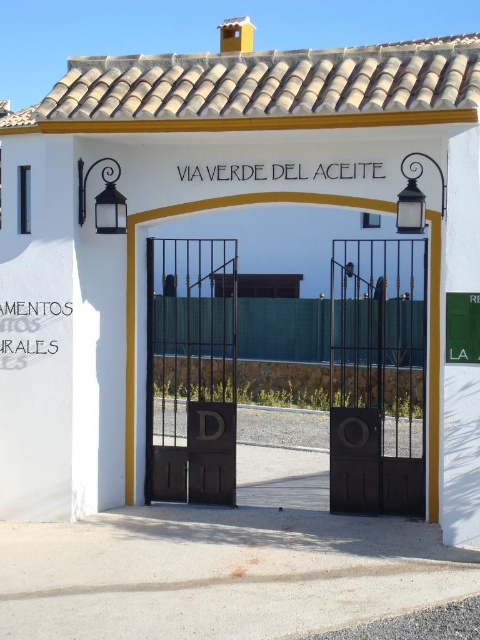
Question: Does black metal gate at center appear on the left side of dark brown wrought iron gate at center?

Choices:
 (A) yes
 (B) no

Answer: (A)

Question: Which object is closer to the camera taking this photo?

Choices:
 (A) brown matte door at center
 (B) black metal gate at center

Answer: (A)

Question: In this image, where is brown matte door at center located relative to black metal gate at center?

Choices:
 (A) above
 (B) below

Answer: (A)

Question: Observing the image, what is the correct spatial positioning of brown matte door at center in reference to black metal gate at center?

Choices:
 (A) above
 (B) below

Answer: (A)

Question: Among these points, which one is farthest from the camera?

Choices:
 (A) (422, 362)
 (B) (192, 305)
 (C) (127, 272)

Answer: (B)

Question: Which point is closer to the camera taking this photo?

Choices:
 (A) (126, 280)
 (B) (208, 317)
 (C) (420, 433)

Answer: (A)